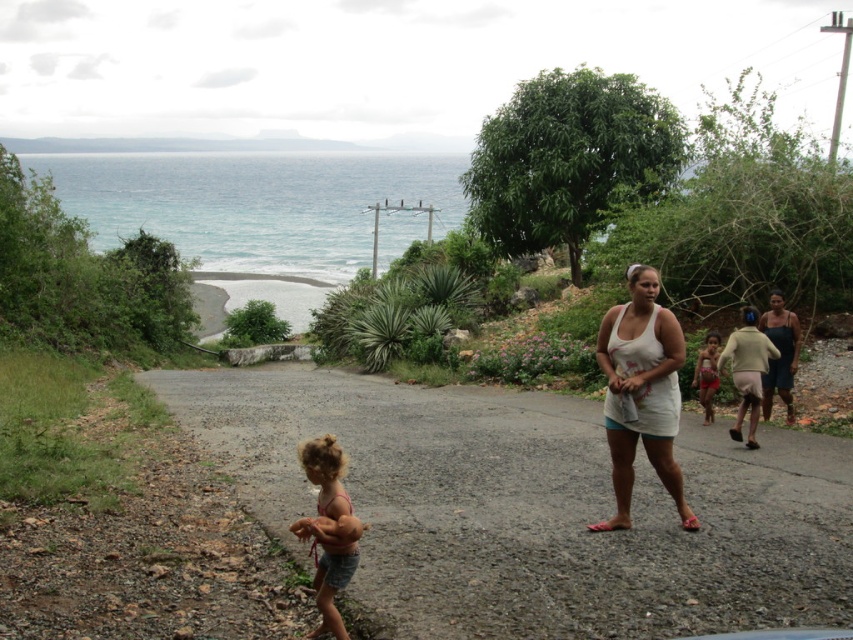
Question: Can you confirm if gray gravel road at center is bigger than curly blonde hair at lower left?

Choices:
 (A) no
 (B) yes

Answer: (B)

Question: Which of these objects is positioned closest to the curly blonde hair at lower left?

Choices:
 (A) gray gravel road at center
 (B) white cotton tank top at center

Answer: (B)

Question: Among these objects, which one is nearest to the camera?

Choices:
 (A) gray gravel road at center
 (B) light beige fabric shorts at right

Answer: (A)

Question: Estimate the real-world distances between objects in this image. Which object is closer to the curly blonde hair at lower left?

Choices:
 (A) white cotton tank top at center
 (B) light beige fabric shorts at right

Answer: (A)

Question: Where is white cotton tank top at center located in relation to curly blonde hair at lower left in the image?

Choices:
 (A) below
 (B) above

Answer: (B)

Question: Can you confirm if white cotton tank top at center is smaller than red fabric shorts at center?

Choices:
 (A) no
 (B) yes

Answer: (A)